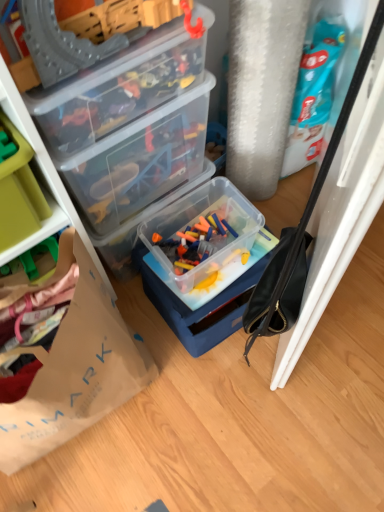
This screenshot has height=512, width=384. What do you see at coordinates (19, 192) in the screenshot? I see `green plastic storage box at left` at bounding box center [19, 192].

Measure the distance between green plastic storage box at left and camera.

green plastic storage box at left is 27.41 inches away from camera.

I want to click on transparent plastic toy box at upper center, the third box in the bottom-to-top sequence, so pyautogui.click(x=117, y=92).

Locate an element on the screen. green plastic storage box at left is located at coordinates (19, 192).

Is brown paper bag at lower left a part of transparent plastic toy box at upper center, the 1th box when ordered from top to bottom?

That's incorrect, brown paper bag at lower left is not inside transparent plastic toy box at upper center, the 1th box when ordered from top to bottom.

From the picture: Between transparent plastic toy box at upper center, the third box in the bottom-to-top sequence, and brown paper bag at lower left, which one has larger size?

With larger size is brown paper bag at lower left.

In the scene shown: From a real-world perspective, is transparent plastic toy box at upper center, the third box in the bottom-to-top sequence, located higher than brown paper bag at lower left?

Indeed, from a real-world perspective, transparent plastic toy box at upper center, the third box in the bottom-to-top sequence, stands above brown paper bag at lower left.

Which object is more forward, transparent plastic toy box at upper center, the third box in the bottom-to-top sequence, or brown paper bag at lower left?

brown paper bag at lower left is more forward.

Does green plastic storage box at left touch brown paper bag at lower left?

green plastic storage box at left is not next to brown paper bag at lower left, and they're not touching.

The image size is (384, 512). I want to click on storage box on the left of brown paper bag at lower left, so click(19, 192).

Does green plastic storage box at left have a smaller size compared to brown paper bag at lower left?

Indeed, green plastic storage box at left has a smaller size compared to brown paper bag at lower left.

In terms of width, does green plastic storage box at left look wider or thinner when compared to brown paper bag at lower left?

Clearly, green plastic storage box at left has less width compared to brown paper bag at lower left.

From a real-world perspective, is transparent plastic toy box at upper center, the 1th box when ordered from top to bottom, physically below translucent plastic container at center, the 3th box in the top-to-bottom sequence?

Incorrect, from a real-world perspective, transparent plastic toy box at upper center, the 1th box when ordered from top to bottom, is higher than translucent plastic container at center, the 3th box in the top-to-bottom sequence.

In the scene shown: Measure the distance between transparent plastic toy box at upper center, the 1th box when ordered from top to bottom, and translucent plastic container at center, the 3th box in the top-to-bottom sequence.

transparent plastic toy box at upper center, the 1th box when ordered from top to bottom, and translucent plastic container at center, the 3th box in the top-to-bottom sequence, are 15.92 inches apart from each other.

Can you tell me how much transparent plastic toy box at upper center, the 1th box when ordered from top to bottom, and translucent plastic container at center, the 3th box in the top-to-bottom sequence, differ in facing direction?

The facing directions of transparent plastic toy box at upper center, the 1th box when ordered from top to bottom, and translucent plastic container at center, the 3th box in the top-to-bottom sequence, are 8.67e-05 degrees apart.

Considering the relative sizes of transparent plastic toy box at upper center, the 1th box when ordered from top to bottom, and translucent plastic container at center, which is the 1th box in bottom-to-top order, in the image provided, is transparent plastic toy box at upper center, the 1th box when ordered from top to bottom, bigger than translucent plastic container at center, which is the 1th box in bottom-to-top order,?

Incorrect, transparent plastic toy box at upper center, the 1th box when ordered from top to bottom, is not larger than translucent plastic container at center, which is the 1th box in bottom-to-top order.

Would you say translucent plastic container at center, which is the 1th box in bottom-to-top order, is to the left or to the right of transparent plastic container at upper left, the second box positioned from the top, in the picture?

translucent plastic container at center, which is the 1th box in bottom-to-top order, is positioned on transparent plastic container at upper left, the second box positioned from the top,'s right side.

Considering the sizes of translucent plastic container at center, the 3th box in the top-to-bottom sequence, and transparent plastic container at upper left, positioned as the 2th box in bottom-to-top order, in the image, is translucent plastic container at center, the 3th box in the top-to-bottom sequence, taller or shorter than transparent plastic container at upper left, positioned as the 2th box in bottom-to-top order,?

Clearly, translucent plastic container at center, the 3th box in the top-to-bottom sequence, is shorter compared to transparent plastic container at upper left, positioned as the 2th box in bottom-to-top order.

Looking at their sizes, would you say translucent plastic container at center, which is the 1th box in bottom-to-top order, is wider or thinner than transparent plastic container at upper left, the second box positioned from the top?

translucent plastic container at center, which is the 1th box in bottom-to-top order, is wider than transparent plastic container at upper left, the second box positioned from the top.

From the image's perspective, which one is positioned lower, translucent plastic container at center, which is the 1th box in bottom-to-top order, or transparent plastic container at upper left, the second box positioned from the top?

translucent plastic container at center, which is the 1th box in bottom-to-top order, is shown below in the image.

Is transparent plastic container at upper left, positioned as the 2th box in bottom-to-top order, bigger or smaller than brown paper bag at lower left?

In the image, transparent plastic container at upper left, positioned as the 2th box in bottom-to-top order, appears to be smaller than brown paper bag at lower left.

Can brown paper bag at lower left be found inside transparent plastic container at upper left, the second box positioned from the top?

No, brown paper bag at lower left is not surrounded by transparent plastic container at upper left, the second box positioned from the top.

Measure the distance from transparent plastic container at upper left, positioned as the 2th box in bottom-to-top order, to brown paper bag at lower left.

transparent plastic container at upper left, positioned as the 2th box in bottom-to-top order, is 12.35 inches away from brown paper bag at lower left.

Between transparent plastic container at upper left, positioned as the 2th box in bottom-to-top order, and brown paper bag at lower left, which one is positioned behind?

Positioned behind is transparent plastic container at upper left, positioned as the 2th box in bottom-to-top order.

From a real-world perspective, is green plastic storage box at left located beneath transparent plastic toy box at upper center, the third box in the bottom-to-top sequence?

Correct, in the physical world, green plastic storage box at left is lower than transparent plastic toy box at upper center, the third box in the bottom-to-top sequence.

Between green plastic storage box at left and transparent plastic toy box at upper center, the third box in the bottom-to-top sequence, which one appears on the left side from the viewer's perspective?

green plastic storage box at left is more to the left.

Does green plastic storage box at left come in front of transparent plastic toy box at upper center, the third box in the bottom-to-top sequence?

Yes.

Does transparent plastic container at upper left, the second box positioned from the top, have a lesser width compared to transparent plastic toy box at upper center, the 1th box when ordered from top to bottom?

Correct, the width of transparent plastic container at upper left, the second box positioned from the top, is less than that of transparent plastic toy box at upper center, the 1th box when ordered from top to bottom.

In the scene shown: Who is smaller, transparent plastic container at upper left, the second box positioned from the top, or transparent plastic toy box at upper center, the third box in the bottom-to-top sequence?

transparent plastic toy box at upper center, the third box in the bottom-to-top sequence.

From the image's perspective, between transparent plastic container at upper left, the second box positioned from the top, and transparent plastic toy box at upper center, the 1th box when ordered from top to bottom, who is located below?

transparent plastic container at upper left, the second box positioned from the top, is shown below in the image.

Where is `paper bag below the transparent plastic toy box at upper center, the 1th box when ordered from top to bottom (from the image's perspective)`? paper bag below the transparent plastic toy box at upper center, the 1th box when ordered from top to bottom (from the image's perspective) is located at coordinates (76, 374).

You are a GUI agent. You are given a task and a screenshot of the screen. Output one action in this format:
    pyautogui.click(x=<x>, y=<y>)
    Task: Click on the paper bag located on the right of green plastic storage box at left
    
    Given the screenshot: What is the action you would take?
    pyautogui.click(x=76, y=374)

From the image, which object appears to be nearer to transparent plastic container at upper left, positioned as the 2th box in bottom-to-top order, translucent plastic container at center, which is the 1th box in bottom-to-top order, or green plastic storage box at left?

The object closer to transparent plastic container at upper left, positioned as the 2th box in bottom-to-top order, is translucent plastic container at center, which is the 1th box in bottom-to-top order.

Estimate the real-world distances between objects in this image. Which object is further from transparent plastic container at upper left, positioned as the 2th box in bottom-to-top order, transparent plastic toy box at upper center, the third box in the bottom-to-top sequence, or brown paper bag at lower left?

brown paper bag at lower left.

When comparing their distances from brown paper bag at lower left, does transparent plastic toy box at upper center, the 1th box when ordered from top to bottom, or green plastic storage box at left seem closer?

The object closer to brown paper bag at lower left is green plastic storage box at left.

Based on their spatial positions, is brown paper bag at lower left or translucent plastic container at center, which is the 1th box in bottom-to-top order, closer to transparent plastic container at upper left, the second box positioned from the top?

Based on the image, translucent plastic container at center, which is the 1th box in bottom-to-top order, appears to be nearer to transparent plastic container at upper left, the second box positioned from the top.

Based on their spatial positions, is green plastic storage box at left or brown paper bag at lower left further from transparent plastic toy box at upper center, the 1th box when ordered from top to bottom?

brown paper bag at lower left is further to transparent plastic toy box at upper center, the 1th box when ordered from top to bottom.

Estimate the real-world distances between objects in this image. Which object is closer to transparent plastic toy box at upper center, the 1th box when ordered from top to bottom, brown paper bag at lower left or transparent plastic container at upper left, the second box positioned from the top?

transparent plastic container at upper left, the second box positioned from the top, is positioned closer to the anchor transparent plastic toy box at upper center, the 1th box when ordered from top to bottom.

Based on their spatial positions, is transparent plastic toy box at upper center, the third box in the bottom-to-top sequence, or translucent plastic container at center, the 3th box in the top-to-bottom sequence, closer to transparent plastic container at upper left, the second box positioned from the top?

transparent plastic toy box at upper center, the third box in the bottom-to-top sequence, is positioned closer to the anchor transparent plastic container at upper left, the second box positioned from the top.

When comparing their distances from transparent plastic container at upper left, the second box positioned from the top, does translucent plastic container at center, the 3th box in the top-to-bottom sequence, or transparent plastic toy box at upper center, the 1th box when ordered from top to bottom, seem further?

translucent plastic container at center, the 3th box in the top-to-bottom sequence, is further to transparent plastic container at upper left, the second box positioned from the top.

The height and width of the screenshot is (512, 384). I want to click on storage box between transparent plastic toy box at upper center, the 1th box when ordered from top to bottom, and brown paper bag at lower left, in the vertical direction, so click(19, 192).

At what (x,y) coordinates should I click in order to perform the action: click on storage box between transparent plastic container at upper left, positioned as the 2th box in bottom-to-top order, and brown paper bag at lower left vertically. Please return your answer as a coordinate pair (x, y). The width and height of the screenshot is (384, 512). Looking at the image, I should click on (19, 192).

Where is `paper bag between green plastic storage box at left and translucent plastic container at center, which is the 1th box in bottom-to-top order`? paper bag between green plastic storage box at left and translucent plastic container at center, which is the 1th box in bottom-to-top order is located at coordinates [x=76, y=374].

Image resolution: width=384 pixels, height=512 pixels. I want to click on box between transparent plastic container at upper left, the second box positioned from the top, and brown paper bag at lower left vertically, so click(x=205, y=265).